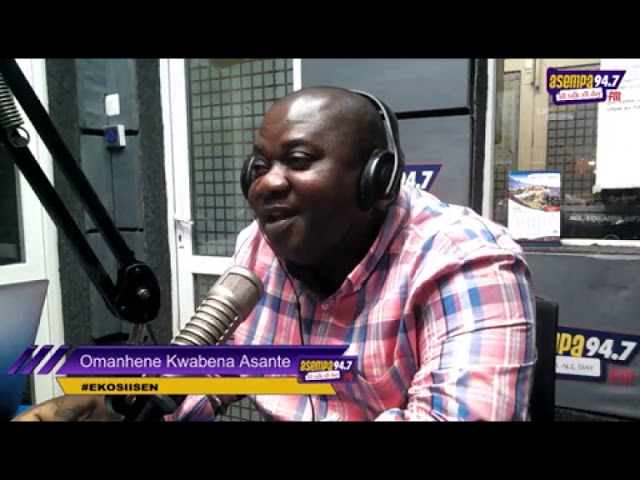
Where is `wall panel`? The width and height of the screenshot is (640, 480). wall panel is located at coordinates (428, 80).